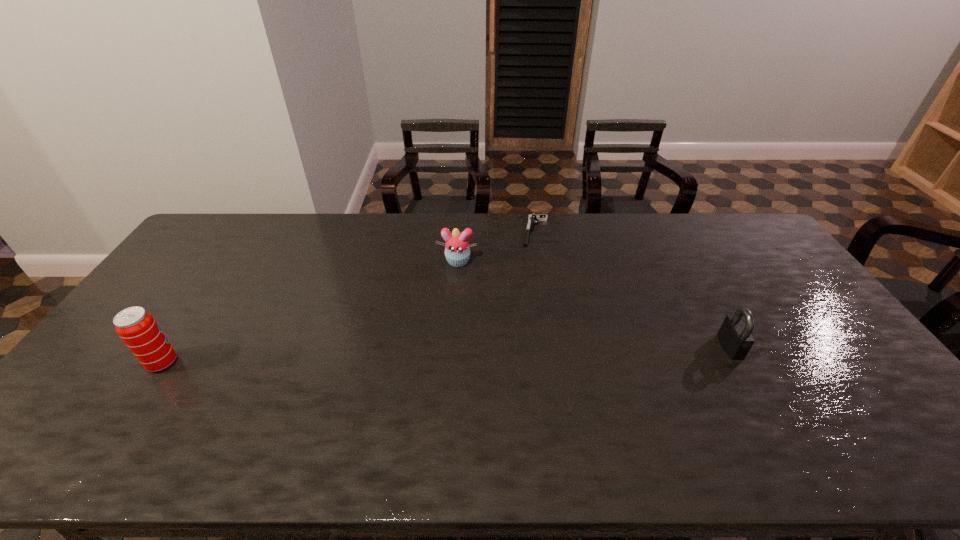
The width and height of the screenshot is (960, 540). I want to click on soda can, so click(x=137, y=328).

At what (x,y) coordinates should I click in order to perform the action: click on the leftmost object. Please return your answer as a coordinate pair (x, y). This screenshot has height=540, width=960. Looking at the image, I should click on (137, 328).

This screenshot has height=540, width=960. I want to click on padlock, so click(x=735, y=335).

Image resolution: width=960 pixels, height=540 pixels. I want to click on cupcake, so 457,252.

Find the location of a particular element. the third object from right to left is located at coordinates (457, 252).

I want to click on the farthest object, so click(532, 218).

Locate an element on the screen. The image size is (960, 540). pistol is located at coordinates (532, 218).

This screenshot has height=540, width=960. Identify the location of vacant position located 0.190m on the back of the leftmost object. (203, 303).

Find the location of a particular element. This screenshot has width=960, height=540. free spot located 0.180m on the front of the padlock near the keyhole is located at coordinates (804, 346).

Find the location of a particular element. Image resolution: width=960 pixels, height=540 pixels. vacant space situated 0.370m on the face of the second object from left to right is located at coordinates (433, 357).